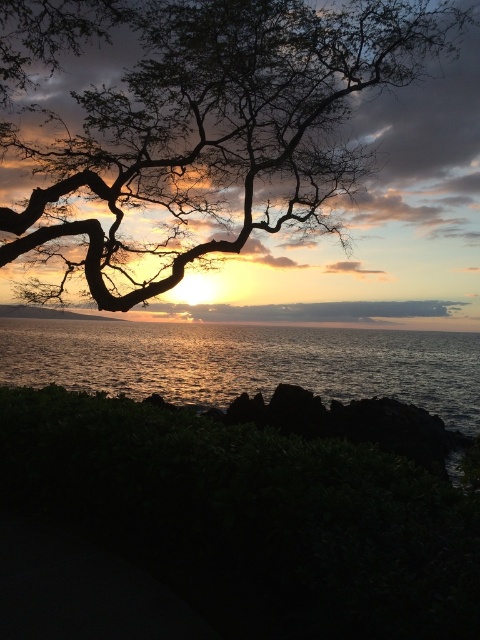
Is point (311, 163) positioned after point (372, 339)?

No, it is in front of (372, 339).

Does point (232, 134) lie in front of point (414, 339)?

That is True.

At what (x,y) coordinates should I click in order to perform the action: click on dark brown bark tree at upper center. Please return your answer as a coordinate pair (x, y). Looking at the image, I should click on point(205,140).